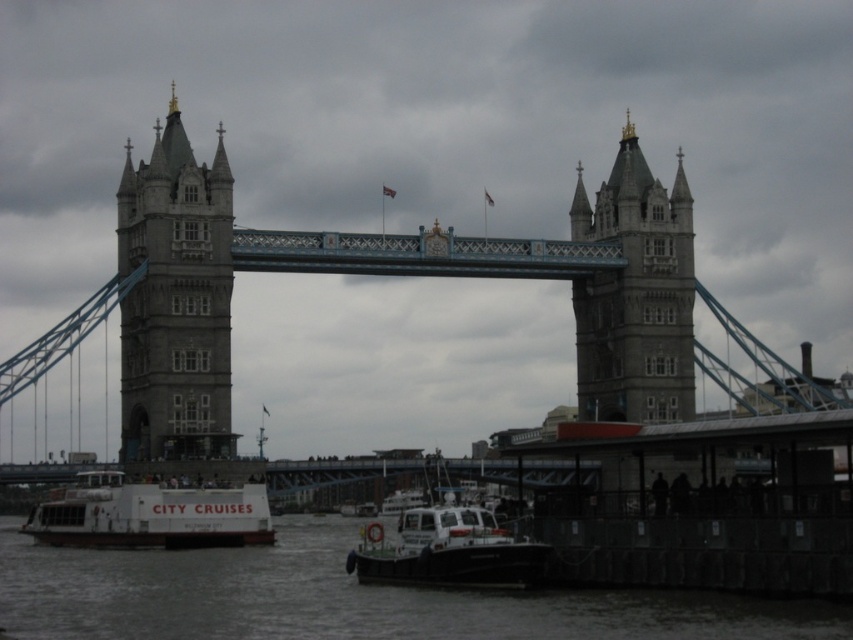
Does white matte water at lower left have a smaller size compared to gray stone tower at center?

Incorrect, white matte water at lower left is not smaller in size than gray stone tower at center.

Is white matte water at lower left further to camera compared to gray stone tower at center?

No.

Is point (387, 636) positioned after point (624, 140)?

No, it is in front of (624, 140).

In order to click on white matte water at lower left in this screenshot , I will do `click(345, 598)`.

Find the location of a particular element. white matte water at lower left is located at coordinates (345, 598).

Does white matte water at lower left have a greater width compared to white plastic boat at lower center?

Indeed, white matte water at lower left has a greater width compared to white plastic boat at lower center.

The image size is (853, 640). I want to click on white matte water at lower left, so (x=345, y=598).

This screenshot has height=640, width=853. What are the coordinates of `white matte water at lower left` in the screenshot? It's located at (345, 598).

Is stone tower at left smaller than white matte boat at lower left?

No.

Can you confirm if stone tower at left is positioned above white matte boat at lower left?

Yes.

Which is in front, point (165, 417) or point (216, 506)?

Positioned in front is point (165, 417).

Locate an element on the screen. The width and height of the screenshot is (853, 640). stone tower at left is located at coordinates (175, 300).